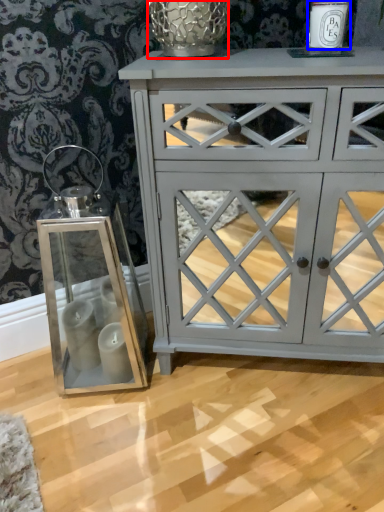
Question: Among these objects, which one is farthest to the camera, glass vase (highlighted by a red box) or candle holder (highlighted by a blue box)?

Choices:
 (A) glass vase
 (B) candle holder

Answer: (A)